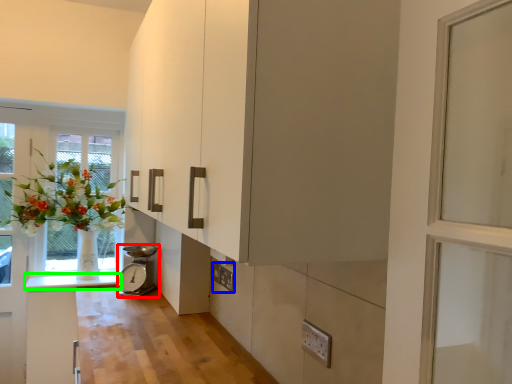
Question: Which is nearer to the appliance (highlighted by a red box)? electric outlet (highlighted by a blue box) or counter top (highlighted by a green box).

Choices:
 (A) electric outlet
 (B) counter top

Answer: (B)